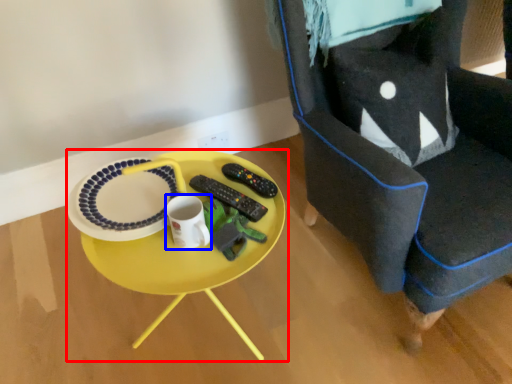
Question: Which object is further to the camera taking this photo, table (highlighted by a red box) or coffee cup (highlighted by a blue box)?

Choices:
 (A) table
 (B) coffee cup

Answer: (B)